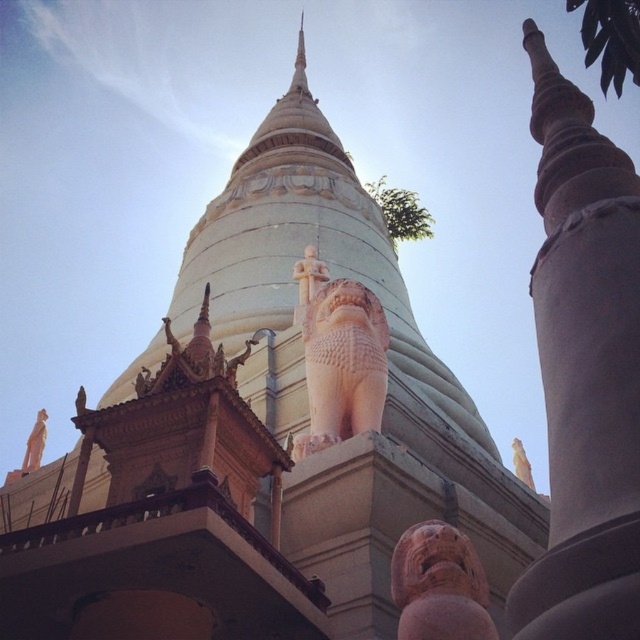
You are standing in front of the temple complex and want to take a photo. There are two points marked in the scene, point 1 at coordinates point (362,348) and point 2 at coordinates point (38,444). Which point is closer to your camera when taking the photo?

Point (362,348) is closer to the camera than point (38,444).

You are standing in the temple complex and see a point marked at coordinates [339,355]. What object is this point located on?

The point is located on the matte pink stone lion at center.